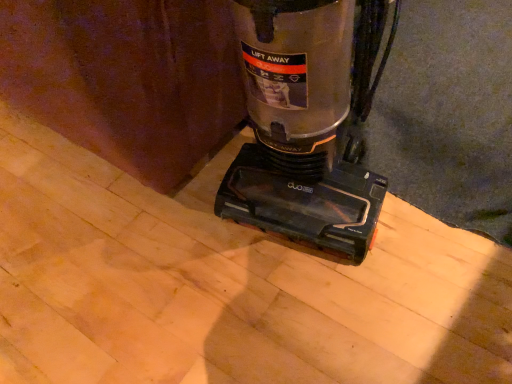
The height and width of the screenshot is (384, 512). Identify the location of metallic vacuum cleaner at center. (309, 122).

What do you see at coordinates (309, 122) in the screenshot? I see `metallic vacuum cleaner at center` at bounding box center [309, 122].

I want to click on metallic vacuum cleaner at center, so click(309, 122).